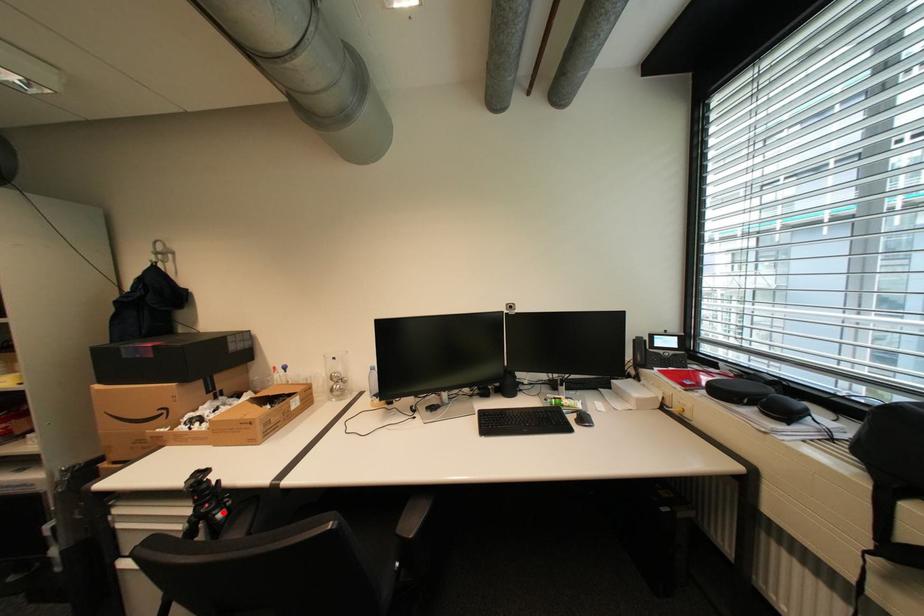
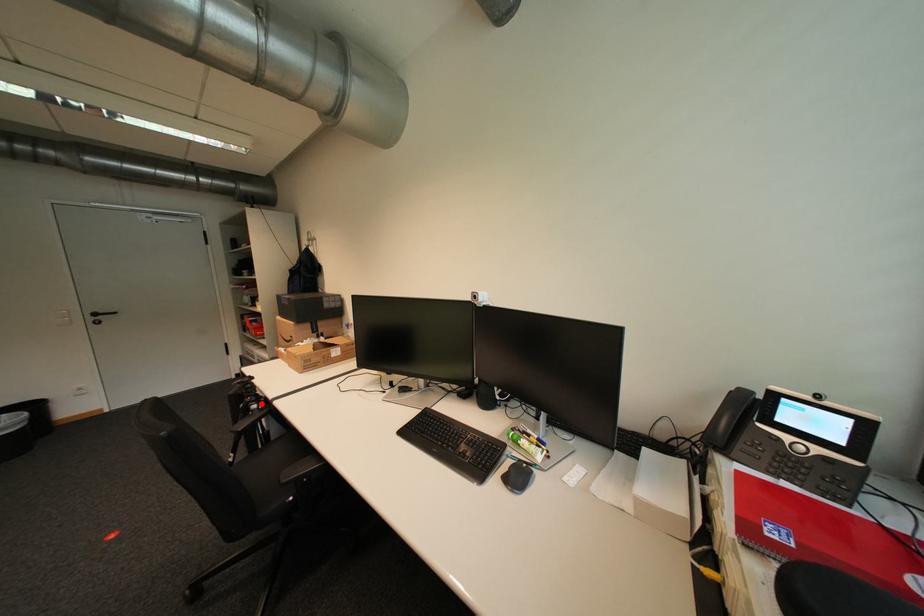
I am providing you with two images of the same scene from different viewpoints. A red point is marked on the first image and another point is marked on the second image. Do the highlighted points in image1 and image2 indicate the same real-world spot?

Yes